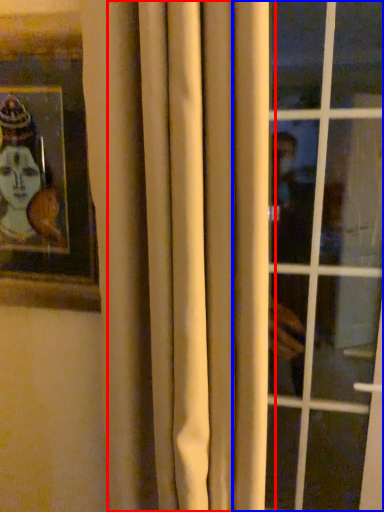
Question: Which of the following is the farthest to the observer, curtain (highlighted by a red box) or window (highlighted by a blue box)?

Choices:
 (A) curtain
 (B) window

Answer: (B)